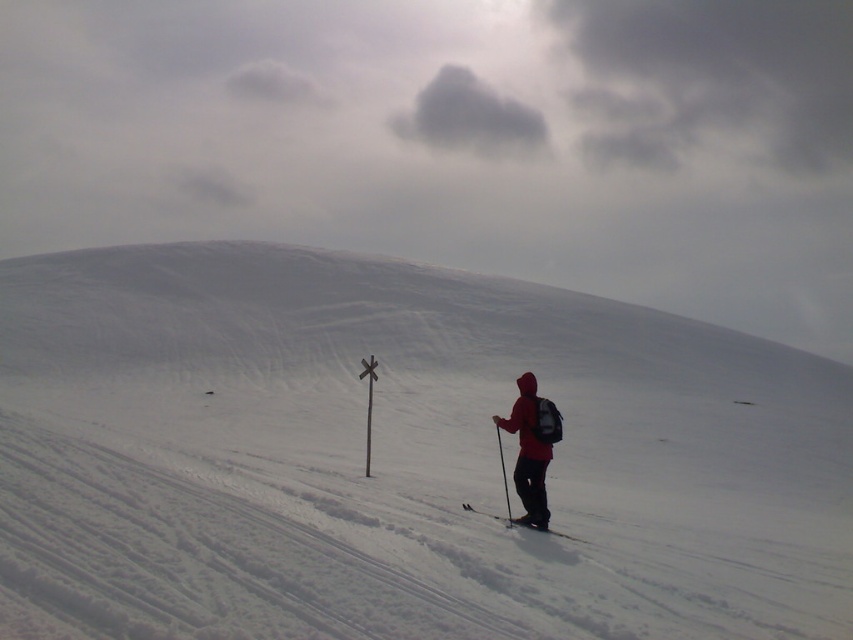
Between matte black ski at lower right and matte black ski pole at lower right, which one appears on the left side from the viewer's perspective?

matte black ski at lower right is more to the left.

Who is more forward, (515, 518) or (506, 500)?

Positioned in front is point (515, 518).

At what (x,y) coordinates should I click in order to perform the action: click on matte black ski at lower right. Please return your answer as a coordinate pair (x, y). Image resolution: width=853 pixels, height=640 pixels. Looking at the image, I should click on (491, 515).

Identify the location of gray fluffy cloud at upper center. The width and height of the screenshot is (853, 640). (276, 84).

At what (x,y) coordinates should I click in order to perform the action: click on gray fluffy cloud at upper center. Please return your answer as a coordinate pair (x, y). The width and height of the screenshot is (853, 640). Looking at the image, I should click on (276, 84).

Which is more to the right, matte red jacket at lower right or matte black ski pole at lower right?

matte red jacket at lower right

Can you confirm if matte red jacket at lower right is shorter than matte black ski pole at lower right?

No, matte red jacket at lower right is not shorter than matte black ski pole at lower right.

Between point (550, 426) and point (505, 483), which one is positioned behind?

Positioned behind is point (505, 483).

The image size is (853, 640). In order to click on matte red jacket at lower right in this screenshot , I will do `click(531, 448)`.